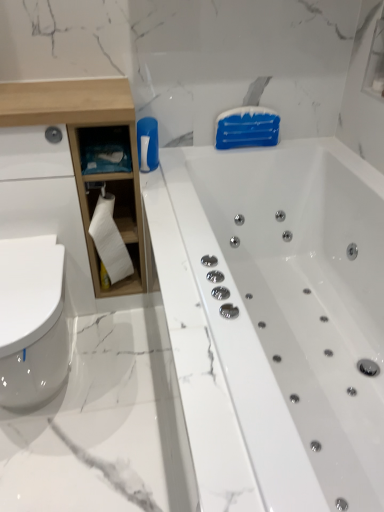
The image size is (384, 512). Identify the location of white matte toilet paper at left. (110, 240).

This screenshot has width=384, height=512. What do you see at coordinates (275, 320) in the screenshot?
I see `white glossy bathtub at center` at bounding box center [275, 320].

In order to click on white glossy bathtub at center in this screenshot , I will do `click(275, 320)`.

At what (x,y) coordinates should I click in order to perform the action: click on white wood cabinet at left. Please return your answer as a coordinate pair (x, y). This screenshot has width=384, height=512. Looking at the image, I should click on (80, 153).

At what (x,y) coordinates should I click in order to perform the action: click on white matte toilet paper at left. Please return your answer as a coordinate pair (x, y). The image size is (384, 512). Looking at the image, I should click on (110, 240).

In terms of height, does white glossy bathtub at center look taller or shorter compared to white glossy toilet at lower left?

Considering their sizes, white glossy bathtub at center has more height than white glossy toilet at lower left.

Locate an element on the screen. The image size is (384, 512). toilet located underneath the white glossy bathtub at center (from a real-world perspective) is located at coordinates (32, 321).

From a real-world perspective, is white glossy bathtub at center located higher than white glossy toilet at lower left?

Yes, from a real-world perspective, white glossy bathtub at center is over white glossy toilet at lower left

Is white glossy bathtub at center aimed at white glossy toilet at lower left?

Yes, white glossy bathtub at center faces towards white glossy toilet at lower left.

Is white glossy toilet at lower left far from white matte toilet paper at left?

No, there isn't a large distance between white glossy toilet at lower left and white matte toilet paper at left.

From the image's perspective, is white glossy toilet at lower left on white matte toilet paper at left?

No, from the image's perspective, white glossy toilet at lower left is not above white matte toilet paper at left.

Does point (9, 284) appear closer or farther from the camera than point (112, 247)?

Point (9, 284).

Considering the positions of objects white glossy toilet at lower left and white matte toilet paper at left in the image provided, who is more to the left, white glossy toilet at lower left or white matte toilet paper at left?

white glossy toilet at lower left is more to the left.

Consider the image. From a real-world perspective, does white matte toilet paper at left sit lower than white wood cabinet at left?

Yes, from a real-world perspective, white matte toilet paper at left is below white wood cabinet at left.

Can you confirm if white matte toilet paper at left is smaller than white wood cabinet at left?

Yes.

Considering the points (126, 261) and (119, 203), which point is behind, point (126, 261) or point (119, 203)?

Positioned behind is point (126, 261).

How many degrees apart are the facing directions of white matte toilet paper at left and white wood cabinet at left?

They differ by 0.611 degrees in their facing directions.

Considering their positions, is white wood cabinet at left located in front of or behind white matte toilet paper at left?

white wood cabinet at left is positioned closer to the viewer than white matte toilet paper at left.

From the image's perspective, is white wood cabinet at left above or below white matte toilet paper at left?

From the image's perspective, white wood cabinet at left appears above white matte toilet paper at left.

Can you confirm if white wood cabinet at left is smaller than white matte toilet paper at left?

No.

Could you tell me if white wood cabinet at left is facing white matte toilet paper at left?

Yes, white wood cabinet at left faces towards white matte toilet paper at left.

From a real-world perspective, which object stands above the other?

white wood cabinet at left.

Is white wood cabinet at left placed right next to white glossy bathtub at center?

white wood cabinet at left is not next to white glossy bathtub at center, and they're not touching.

Which is correct: white wood cabinet at left is inside white glossy bathtub at center, or outside of it?

white wood cabinet at left is spatially situated outside white glossy bathtub at center.

Locate an element on the screen. This screenshot has width=384, height=512. bathtub in front of the white wood cabinet at left is located at coordinates click(275, 320).

How distant is white glossy toilet at lower left from white wood cabinet at left?

They are 16.11 inches apart.

From a real-world perspective, is white glossy toilet at lower left under white wood cabinet at left?

Yes.

In terms of height, does white glossy toilet at lower left look taller or shorter compared to white wood cabinet at left?

white glossy toilet at lower left is shorter than white wood cabinet at left.

Between white glossy toilet at lower left and white wood cabinet at left, which one is positioned in front?

white glossy toilet at lower left.

Which is correct: white wood cabinet at left is inside white glossy toilet at lower left, or outside of it?

white wood cabinet at left lies outside white glossy toilet at lower left.

From a real-world perspective, is white wood cabinet at left under white glossy toilet at lower left?

No, from a real-world perspective, white wood cabinet at left is not below white glossy toilet at lower left.

Which object is more forward, white wood cabinet at left or white glossy toilet at lower left?

white glossy toilet at lower left is closer to the camera.

The image size is (384, 512). Find the location of `toilet that appears on the left of white glossy bathtub at center`. toilet that appears on the left of white glossy bathtub at center is located at coordinates (32, 321).

The image size is (384, 512). Find the location of `toilet paper above the white glossy toilet at lower left (from the image's perspective)`. toilet paper above the white glossy toilet at lower left (from the image's perspective) is located at coordinates (110, 240).

Considering their positions, is white glossy toilet at lower left positioned further to white matte toilet paper at left than white wood cabinet at left?

Based on the image, white glossy toilet at lower left appears to be further to white matte toilet paper at left.

Estimate the real-world distances between objects in this image. Which object is closer to white glossy toilet at lower left, white matte toilet paper at left or white glossy bathtub at center?

The object closer to white glossy toilet at lower left is white matte toilet paper at left.

When comparing their distances from white glossy toilet at lower left, does white matte toilet paper at left or white wood cabinet at left seem further?

white wood cabinet at left is positioned further to the anchor white glossy toilet at lower left.

Considering their positions, is white matte toilet paper at left positioned further to white wood cabinet at left than white glossy toilet at lower left?

white glossy toilet at lower left is further to white wood cabinet at left.

When comparing their distances from white glossy bathtub at center, does white wood cabinet at left or white glossy toilet at lower left seem further?

white glossy toilet at lower left is positioned further to the anchor white glossy bathtub at center.

From the image, which object appears to be nearer to white matte toilet paper at left, white glossy bathtub at center or white glossy toilet at lower left?

The object closer to white matte toilet paper at left is white glossy toilet at lower left.

Looking at the image, which one is located further to white glossy toilet at lower left, white glossy bathtub at center or white matte toilet paper at left?

white glossy bathtub at center is positioned further to the anchor white glossy toilet at lower left.

From the image, which object appears to be farther from white glossy bathtub at center, white glossy toilet at lower left or white wood cabinet at left?

white glossy toilet at lower left.

At what (x,y) coordinates should I click in order to perform the action: click on toilet paper located between white glossy toilet at lower left and white glossy bathtub at center in the left-right direction. Please return your answer as a coordinate pair (x, y). Looking at the image, I should click on (110, 240).

Image resolution: width=384 pixels, height=512 pixels. I want to click on cabinetry located between white glossy toilet at lower left and white glossy bathtub at center in the left-right direction, so click(x=80, y=153).

This screenshot has width=384, height=512. What are the coordinates of `toilet paper between white wood cabinet at left and white glossy toilet at lower left vertically` in the screenshot? It's located at (110, 240).

This screenshot has height=512, width=384. I want to click on toilet paper between white wood cabinet at left and white glossy bathtub at center in the horizontal direction, so click(x=110, y=240).